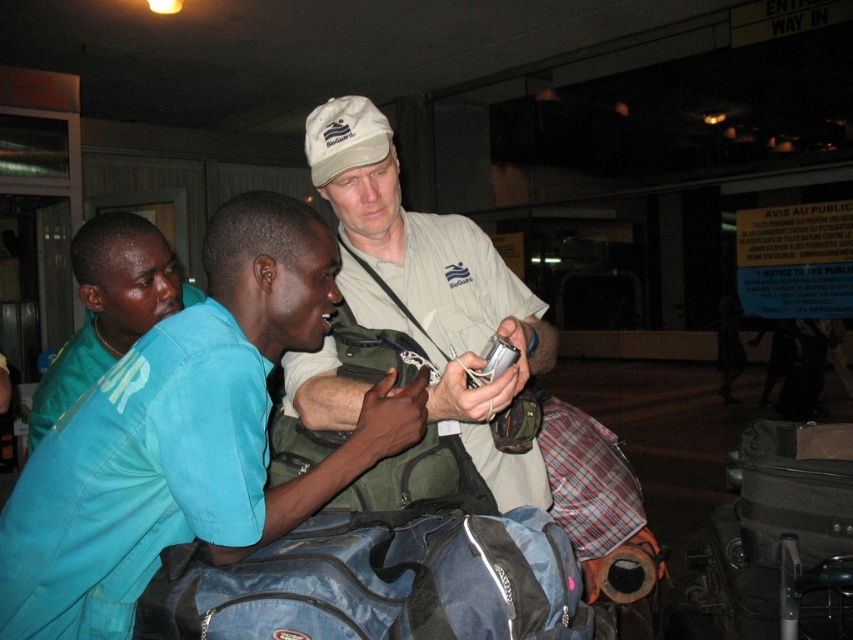
Is point (61, 570) more distant than point (219, 572)?

That is True.

Based on the photo, between light brown leather jacket at center and blue fabric duffel bag at center, which one appears on the left side from the viewer's perspective?

Positioned to the left is light brown leather jacket at center.

What do you see at coordinates (186, 435) in the screenshot? I see `light brown leather jacket at center` at bounding box center [186, 435].

You are a GUI agent. You are given a task and a screenshot of the screen. Output one action in this format:
    pyautogui.click(x=<x>, y=<y>)
    Task: Click on the light brown leather jacket at center
    This screenshot has height=640, width=853.
    Given the screenshot: What is the action you would take?
    pyautogui.click(x=186, y=435)

Does blue fabric duffel bag at center appear on the left side of blue-green shirt at center?

In fact, blue fabric duffel bag at center is to the right of blue-green shirt at center.

Can you confirm if blue fabric duffel bag at center is shorter than blue-green shirt at center?

Indeed, blue fabric duffel bag at center has a lesser height compared to blue-green shirt at center.

Is point (547, 552) more distant than point (103, 349)?

No, (547, 552) is closer to viewer.

Image resolution: width=853 pixels, height=640 pixels. Identify the location of blue fabric duffel bag at center. (379, 580).

Is point (47, 612) positioned after point (309, 141)?

No.

Which is in front, point (136, 392) or point (526, 291)?

Point (136, 392)

Is point (223, 300) farther from viewer compared to point (498, 298)?

No, it is in front of (498, 298).

The height and width of the screenshot is (640, 853). What are the coordinates of `light brown leather jacket at center` in the screenshot? It's located at (186, 435).